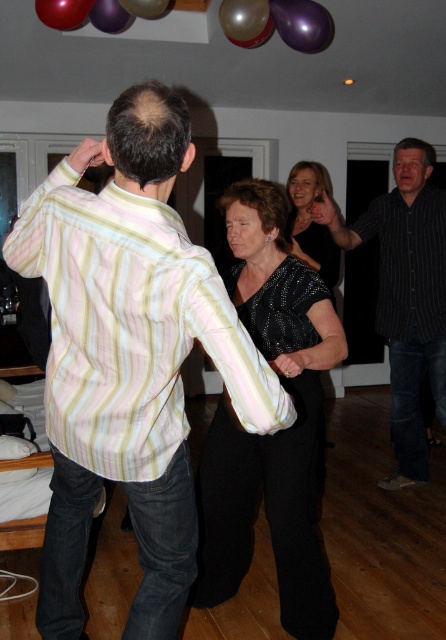
Question: Which of the following is the closest to the observer?

Choices:
 (A) metallic purple balloon at upper center
 (B) striped shirt at right
 (C) sparkly black dress at center

Answer: (B)

Question: Which point is farther to the camera?

Choices:
 (A) (12, 264)
 (B) (107, 12)
 (C) (330, 268)
 (D) (317, 49)

Answer: (C)

Question: Which point is farther to the camera?

Choices:
 (A) striped cotton shirt at center
 (B) striped shirt at right

Answer: (B)

Question: Considering the relative positions of metallic purple balloon at upper center and glossy red balloon at upper left in the image provided, where is metallic purple balloon at upper center located with respect to glossy red balloon at upper left?

Choices:
 (A) above
 (B) below

Answer: (A)

Question: Can you confirm if metallic purple balloon at upper center is positioned to the right of metallic silver balloon at upper center?

Choices:
 (A) no
 (B) yes

Answer: (B)

Question: In this image, where is striped cotton shirt at center located relative to sparkly black dress at center?

Choices:
 (A) right
 (B) left

Answer: (B)